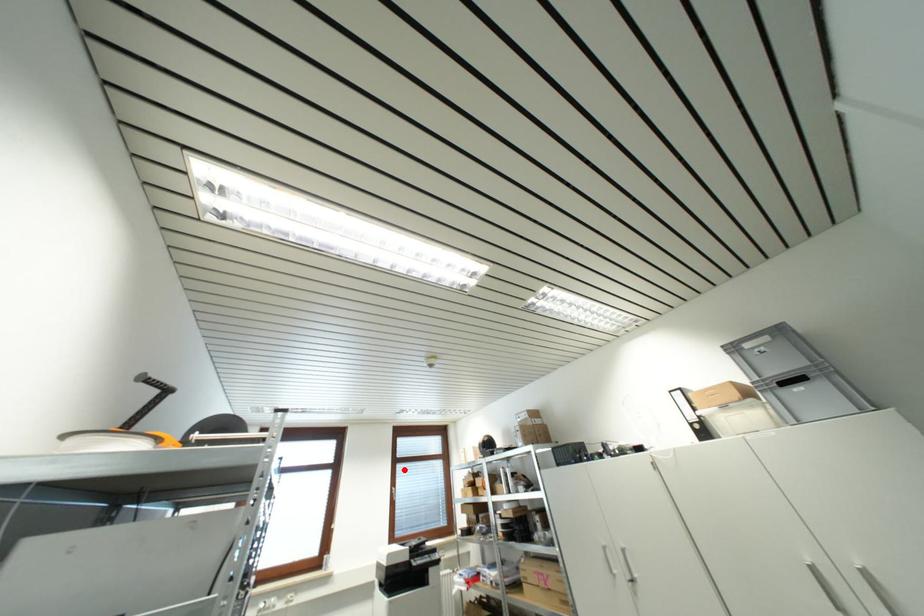
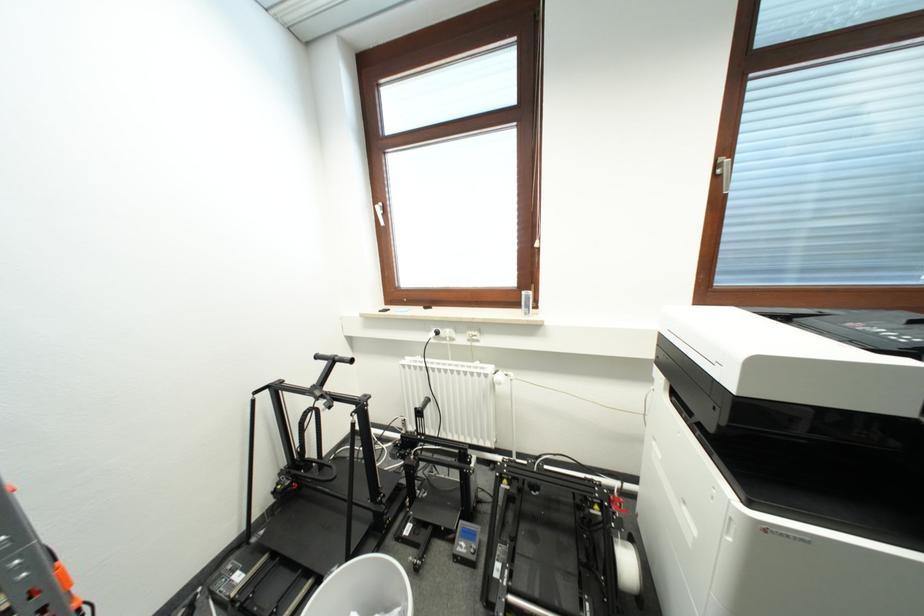
Question: I am providing you with two images of the same scene from different viewpoints. A red point is shown in image1. For the corresponding object point in image2, is it positioned nearer or farther from the camera?

Choices:
 (A) Nearer
 (B) Farther

Answer: (A)